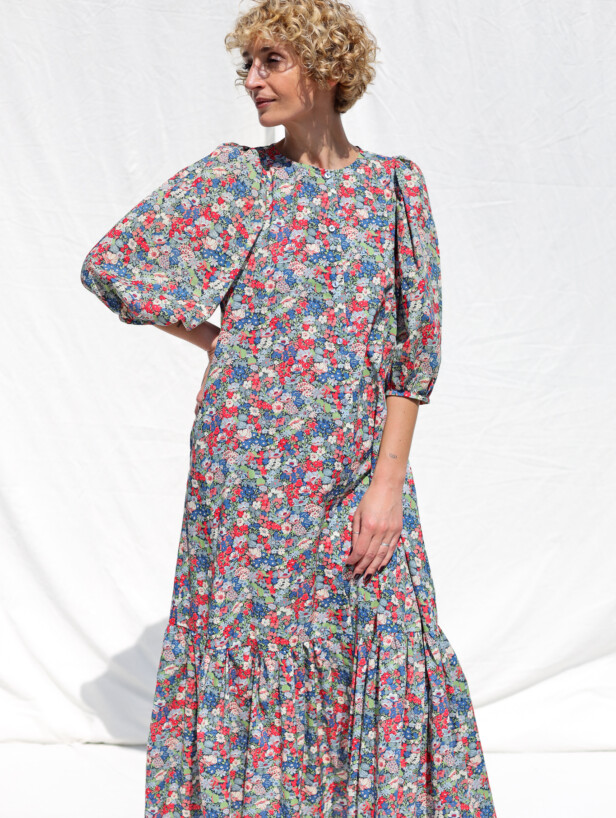
At what (x,y) coordinates should I click in order to perform the action: click on wall. Please return your answer as a coordinate pair (x, y). The height and width of the screenshot is (818, 616). Looking at the image, I should click on (100, 715).